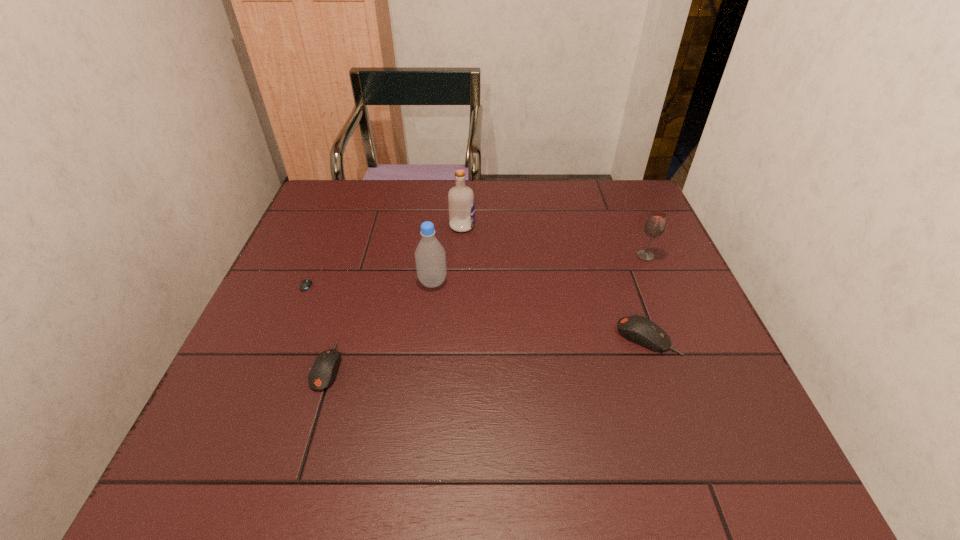
Locate an element on the screen. the fifth tallest object is located at coordinates (323, 371).

This screenshot has height=540, width=960. I want to click on the fifth object from right to left, so click(323, 371).

You are a GUI agent. You are given a task and a screenshot of the screen. Output one action in this format:
    pyautogui.click(x=<x>, y=<y>)
    Task: Click on the fourth tallest object
    The width and height of the screenshot is (960, 540).
    Given the screenshot: What is the action you would take?
    (x=638, y=329)

The height and width of the screenshot is (540, 960). I want to click on the tallest mouse, so click(x=638, y=329).

This screenshot has height=540, width=960. I want to click on glass drink container, so click(x=655, y=225).

What are the coordinates of `the fifth nearest object` in the screenshot? It's located at (655, 225).

Where is `the farthest object`? The image size is (960, 540). the farthest object is located at coordinates (461, 205).

Locate an element on the screen. Image resolution: width=960 pixels, height=540 pixels. bottle is located at coordinates (430, 258).

Locate an element on the screen. the leftmost mouse is located at coordinates coord(305,284).

Where is `the shortest object`? The width and height of the screenshot is (960, 540). the shortest object is located at coordinates (305, 284).